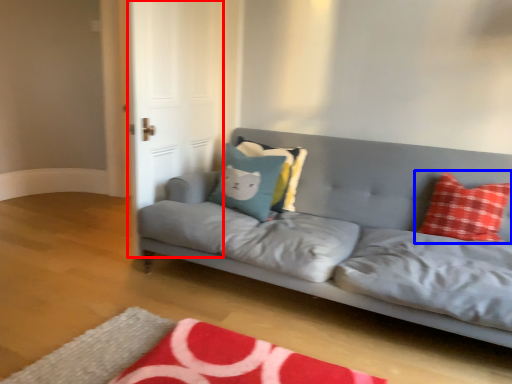
Question: Which of the following is the farthest to the observer, glass door (highlighted by a red box) or pillow (highlighted by a blue box)?

Choices:
 (A) glass door
 (B) pillow

Answer: (A)